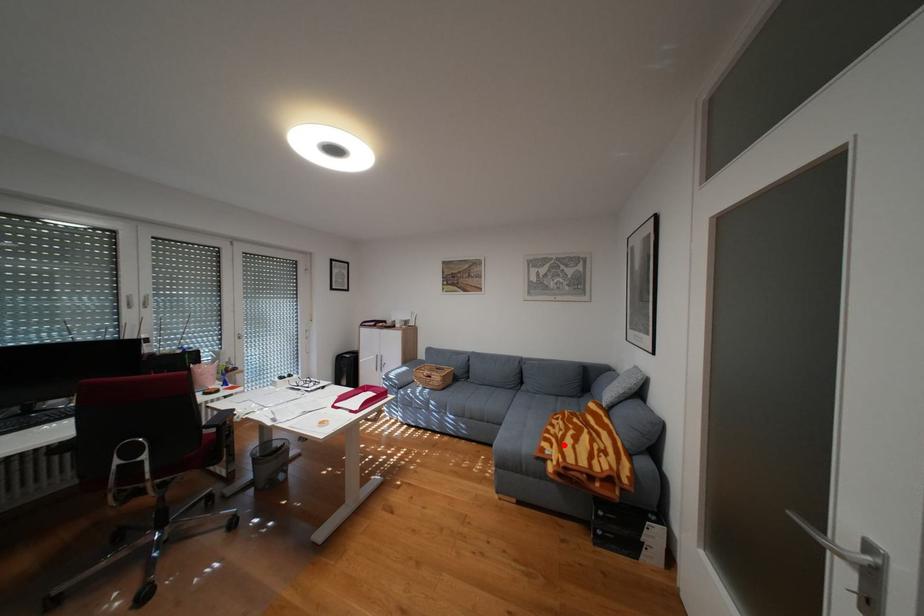
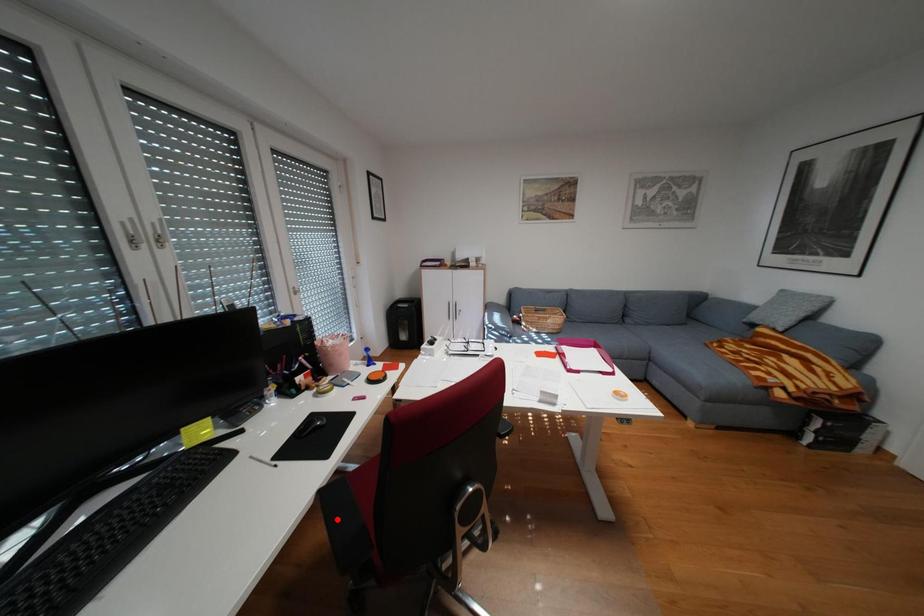
I am providing you with two images of the same scene from different viewpoints. A red point is marked on the first image and another point is marked on the second image. Are the points marked in image1 and image2 representing the same 3D position?

No